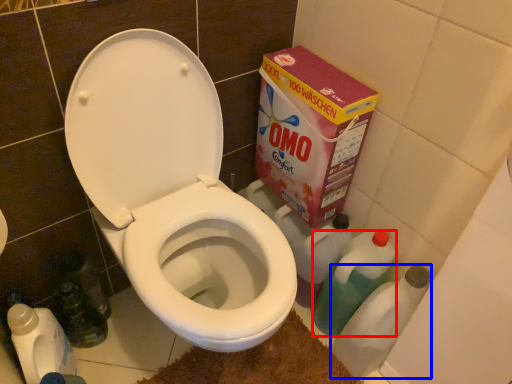
Question: Among these objects, which one is nearest to the camera, cleaning product (highlighted by a red box) or bottle (highlighted by a blue box)?

Choices:
 (A) cleaning product
 (B) bottle

Answer: (B)